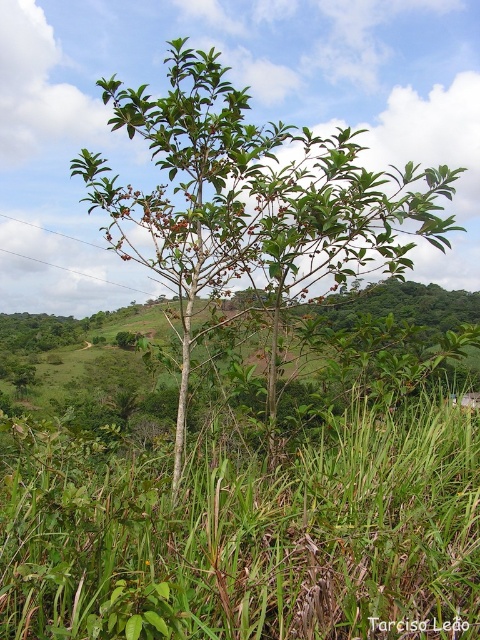
Question: Can you confirm if green grass at center is wider than green leafy tree at center?

Choices:
 (A) no
 (B) yes

Answer: (B)

Question: Is green grass at center to the right of green leafy tree at center from the viewer's perspective?

Choices:
 (A) yes
 (B) no

Answer: (A)

Question: Which point is farther to the camera?

Choices:
 (A) coord(325,228)
 (B) coord(166,621)

Answer: (A)

Question: Which object appears closest to the camera in this image?

Choices:
 (A) green leafy tree at center
 (B) green grass at center

Answer: (B)

Question: Which object is closer to the camera taking this photo?

Choices:
 (A) green grass at center
 (B) green leafy tree at center

Answer: (A)

Question: Does green grass at center appear under green leafy tree at center?

Choices:
 (A) yes
 (B) no

Answer: (A)